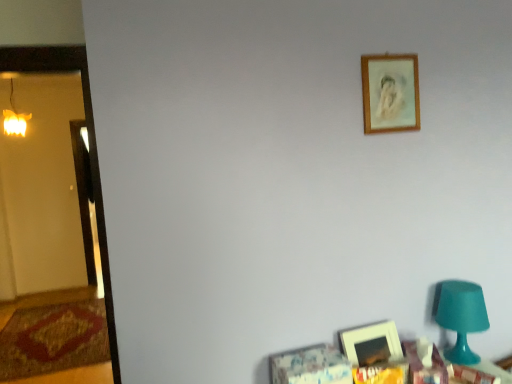
Question: Is matte wooden picture frame at lower right, the 1th picture frame positioned from the bottom, bigger or smaller than warm yellow glass at left?

Choices:
 (A) big
 (B) small

Answer: (B)

Question: Choose the correct answer: Is matte wooden picture frame at lower right, the 1th picture frame positioned from the bottom, inside warm yellow glass at left or outside it?

Choices:
 (A) inside
 (B) outside

Answer: (B)

Question: Estimate the real-world distances between objects in this image. Which object is farther from the wooden frame at upper right, which is the second picture frame in bottom-to-top order?

Choices:
 (A) warm yellow glass at left
 (B) matte wooden picture frame at lower right, the 1th picture frame positioned from the bottom
 (C) wooden table at lower right
 (D) teal plastic table lamp at lower right

Answer: (A)

Question: Which is nearer to the wooden frame at upper right, which is the second picture frame in bottom-to-top order?

Choices:
 (A) wooden table at lower right
 (B) teal plastic table lamp at lower right
 (C) matte wooden picture frame at lower right, the 2th picture frame when ordered from top to bottom
 (D) warm yellow glass at left

Answer: (B)